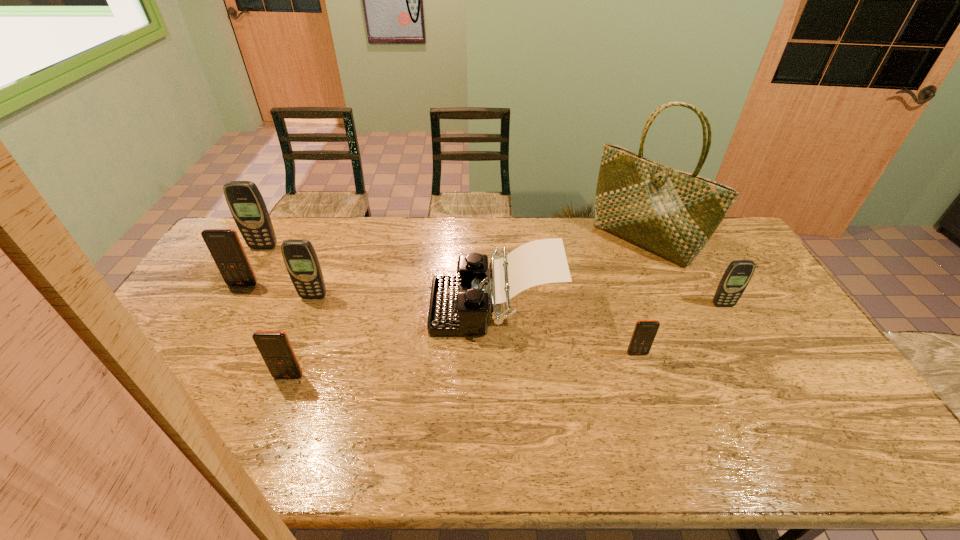
Identify the location of the tallest object. The height and width of the screenshot is (540, 960). (671, 213).

At what (x,y) coordinates should I click in order to perform the action: click on shopping bag. Please return your answer as a coordinate pair (x, y). The image size is (960, 540). Looking at the image, I should click on (671, 213).

This screenshot has width=960, height=540. What are the coordinates of `the leftmost gray cellular telephone` in the screenshot? It's located at (247, 206).

Where is `the farthest gray cellular telephone`? The image size is (960, 540). the farthest gray cellular telephone is located at coordinates (247, 206).

This screenshot has width=960, height=540. I want to click on the leftmost orange cellular telephone, so click(x=224, y=245).

Identify the location of the second farthest cellular telephone. The width and height of the screenshot is (960, 540). pyautogui.click(x=224, y=245).

Locate an element on the screen. This screenshot has height=540, width=960. the second biggest gray cellular telephone is located at coordinates (300, 258).

This screenshot has width=960, height=540. Identify the location of the second nearest gray cellular telephone. (300, 258).

Locate an element on the screen. the fourth object from right to left is located at coordinates (459, 304).

This screenshot has width=960, height=540. I want to click on the rightmost gray cellular telephone, so click(736, 277).